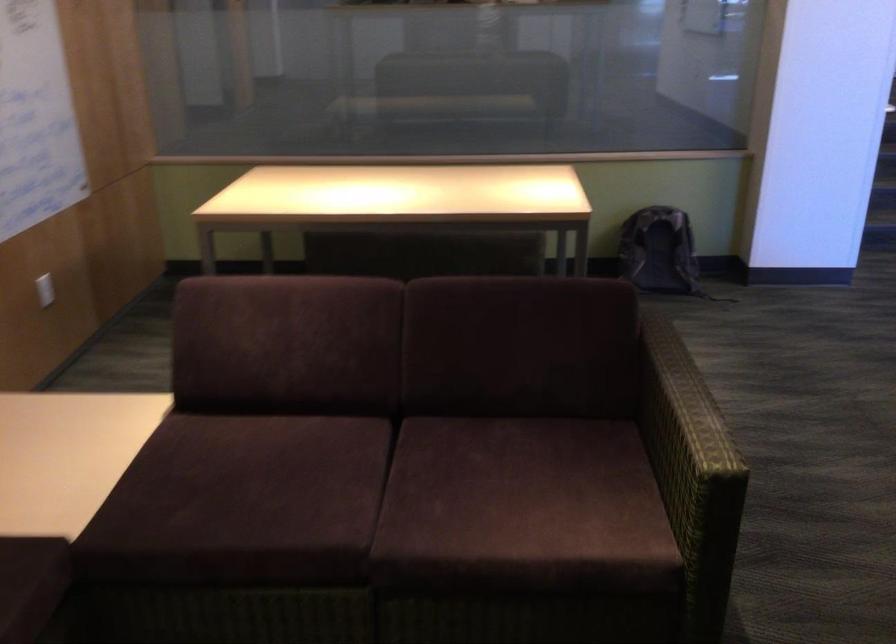
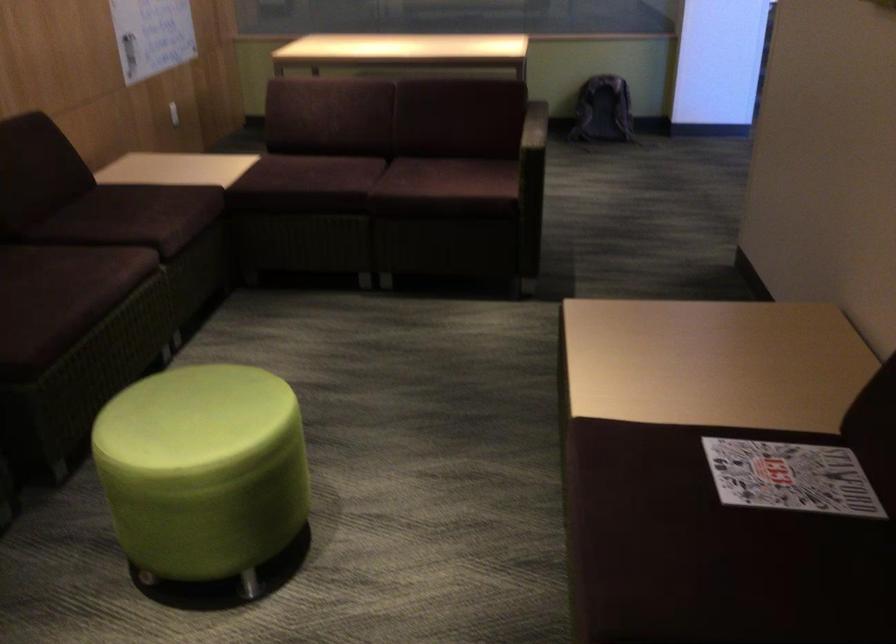
The point at (369,527) is marked in the first image. Where is the corresponding point in the second image?

(371, 185)